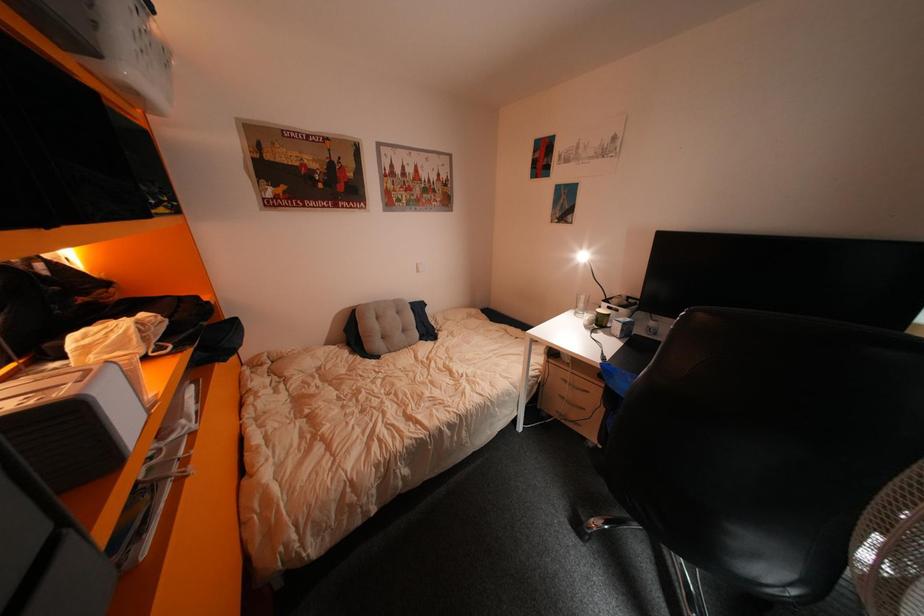
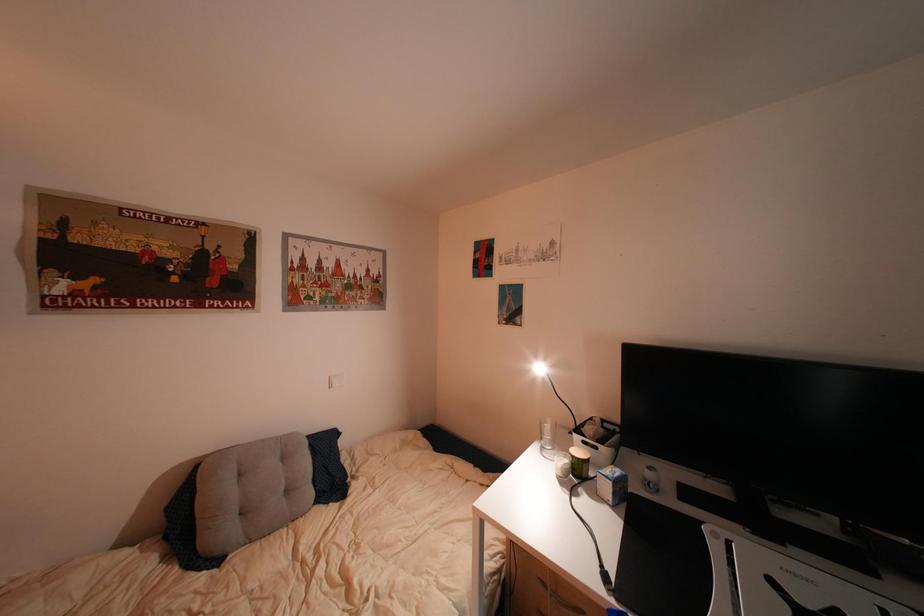
Question: The images are taken continuously from a first-person perspective. In which direction is your viewpoint rotating?

Choices:
 (A) Left
 (B) Right
 (C) Up
 (D) Down

Answer: (C)